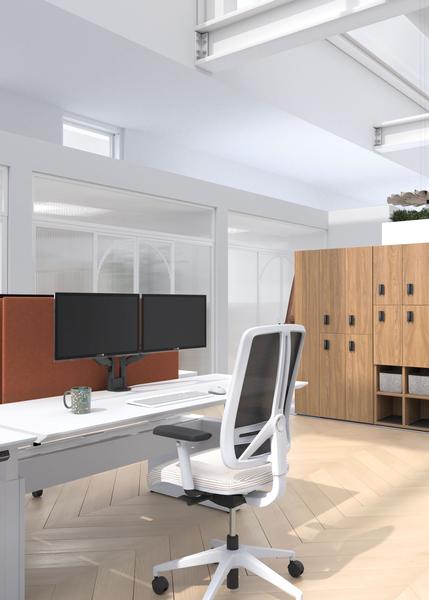
Where is `window`? This screenshot has height=600, width=429. window is located at coordinates (90, 145).